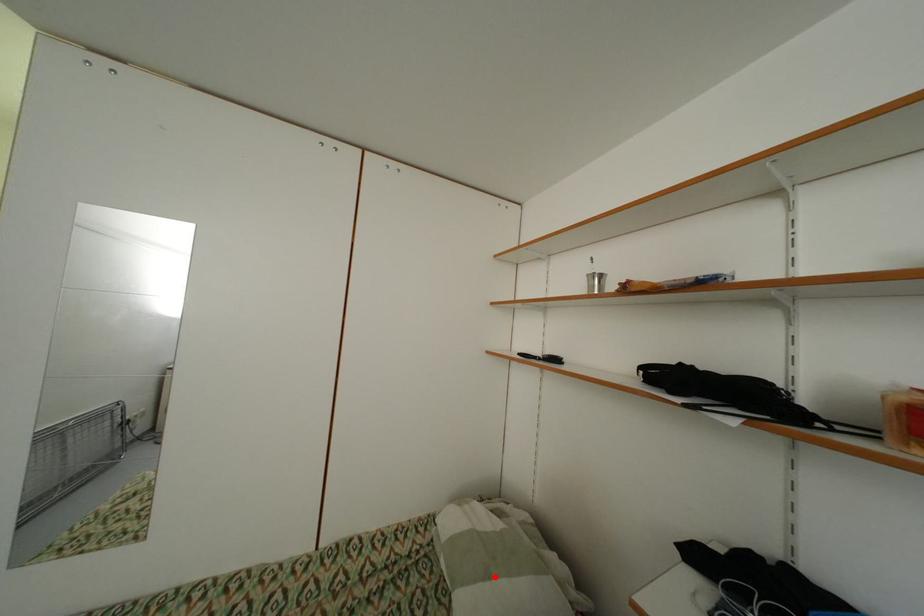
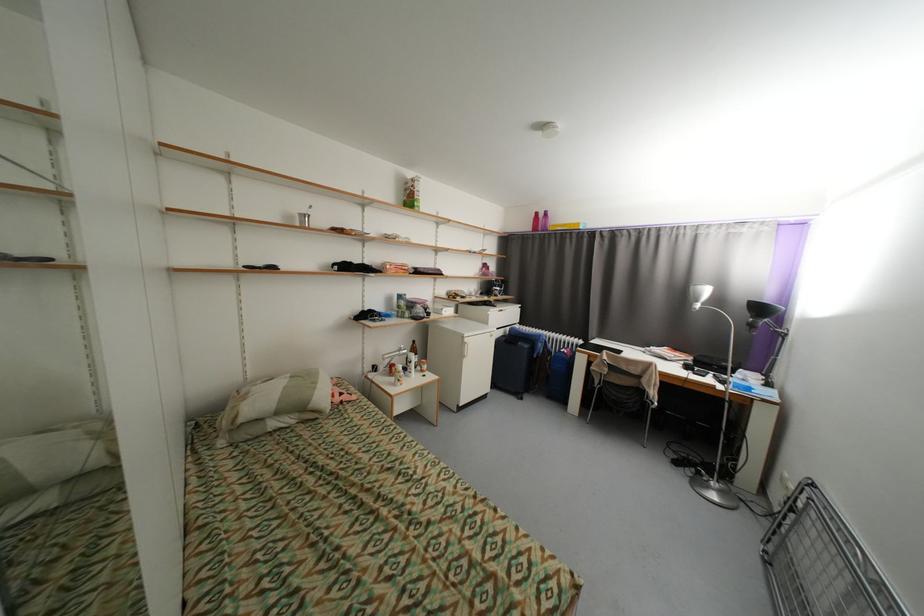
Question: I am providing you with two images of the same scene from different viewpoints. Image1 has a red point marked. In image2, the corresponding 3D location appears at what relative position? Reply with the corresponding letter.

Choices:
 (A) Closer
 (B) Farther

Answer: (A)